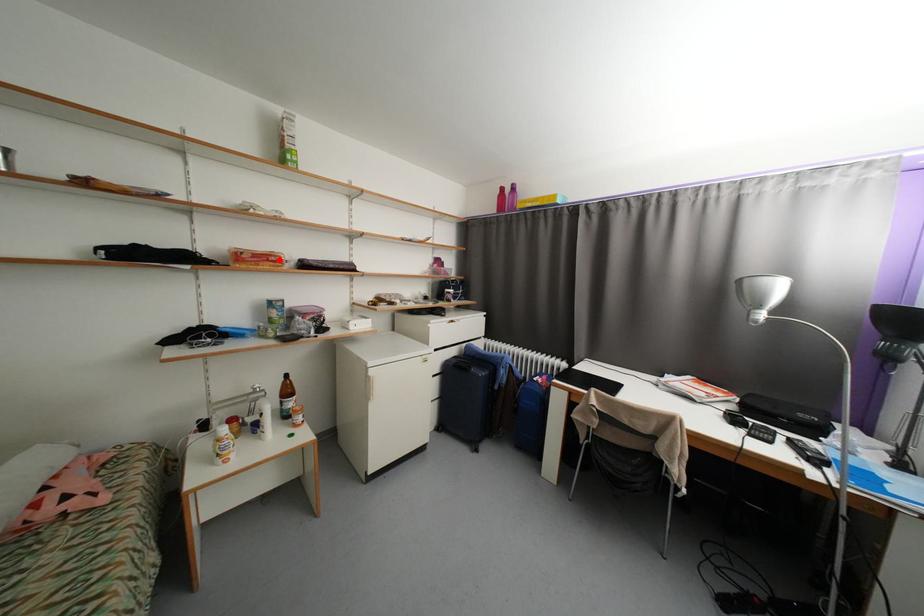
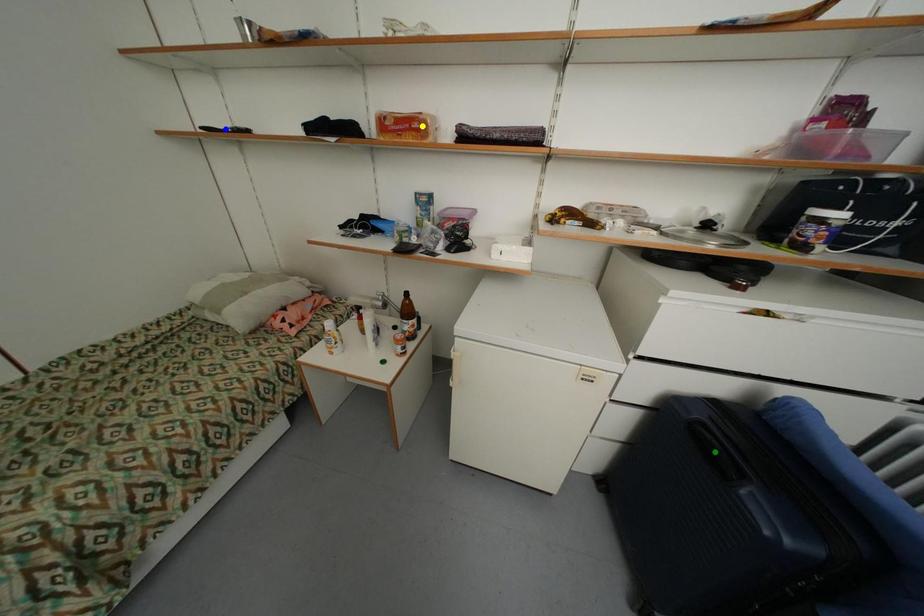
Question: I am providing you with two images of the same scene from different viewpoints. A red point is marked on the first image. You are given multiple points on the second image. Can you choose the point in image 2 that corresponds to the point in image 1?

Choices:
 (A) green point
 (B) yellow point
 (C) blue point

Answer: (B)